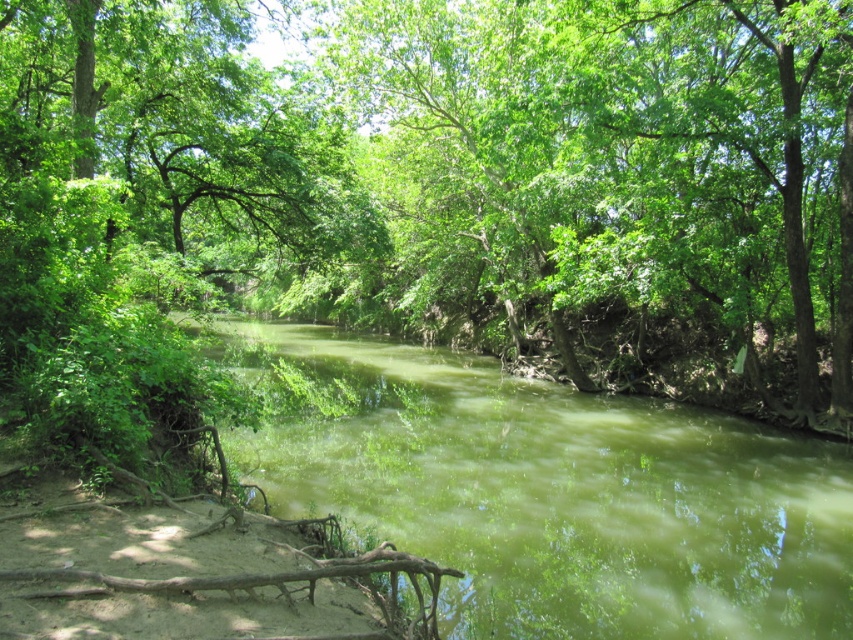
You are a hiker who wants to cross the river using the green leafy tree at center and the green murky water at center. Which object should you avoid stepping on to stay dry?

You should avoid stepping on the green murky water at center because it is the water body, while the green leafy tree at center is solid ground.

You are standing in the middle of the river and want to reach the green leafy tree at center and the green murky water at center. Which one is closer to you?

The green murky water at center is closer to you because the green leafy tree at center is further away from you.

You are a photographer standing at the riverbank and want to take a photo of the green leafy tree at center. If your camera has a maximum focus range of 8 meters, will it be able to capture the tree clearly?

The green leafy tree at center is 8.81 meters from camera, which exceeds the camera maximum focus range of 8 meters. So the camera cannot capture the tree clearly.